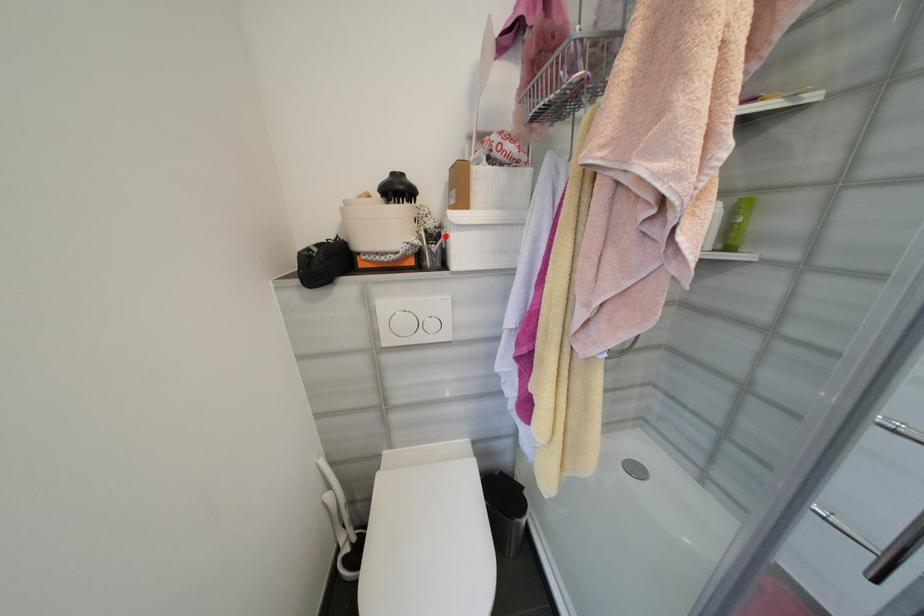
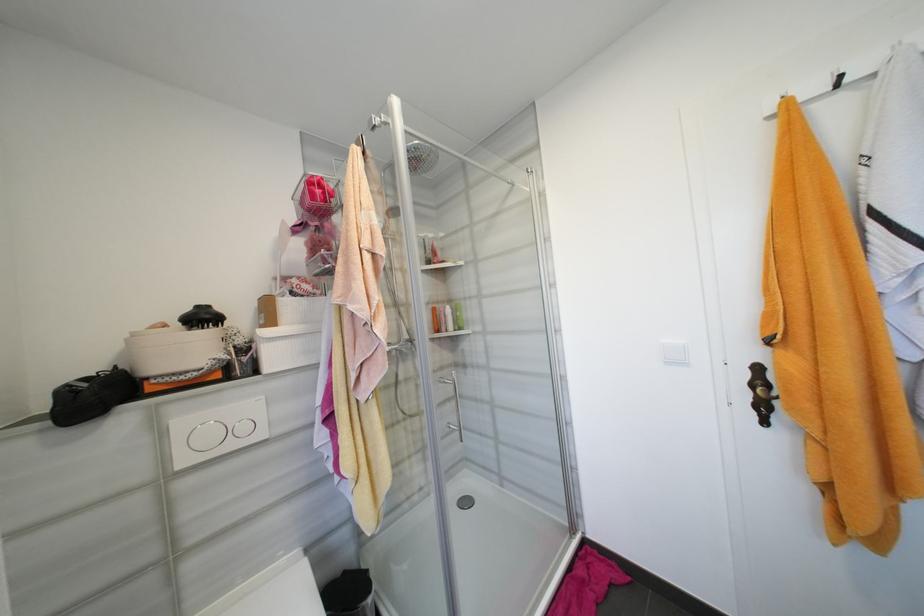
Locate, in the second image, the point that corresponds to the highlighted location in the first image.

(256, 349)